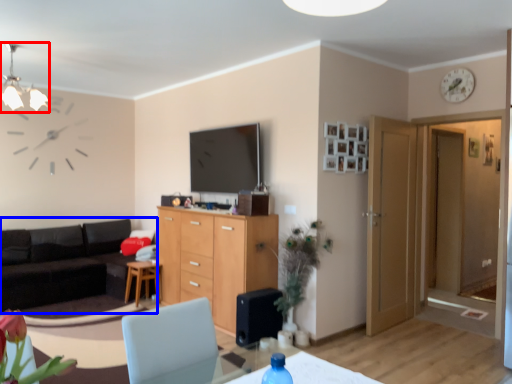
Question: Which object appears farthest to the camera in this image, light fixture (highlighted by a red box) or studio couch (highlighted by a blue box)?

Choices:
 (A) light fixture
 (B) studio couch

Answer: (B)